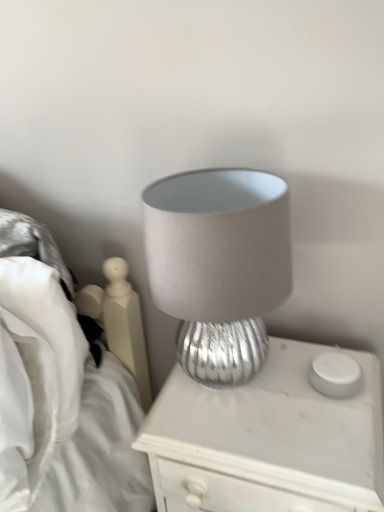
At what (x,y) coordinates should I click in order to perform the action: click on free space in front of white matte candle holder at right. Please return your answer as a coordinate pair (x, y). Looking at the image, I should click on (337, 434).